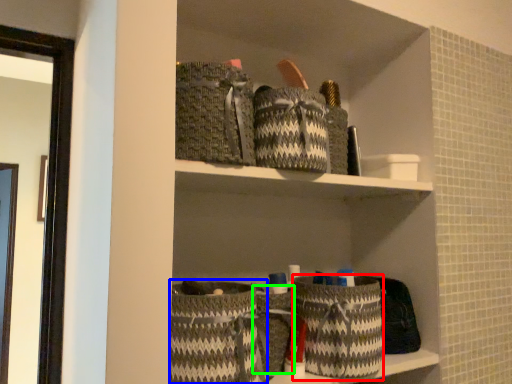
Question: Which is farther away from basket (highlighted by a red box)? basket (highlighted by a blue box) or basket (highlighted by a green box)?

Choices:
 (A) basket
 (B) basket

Answer: (A)